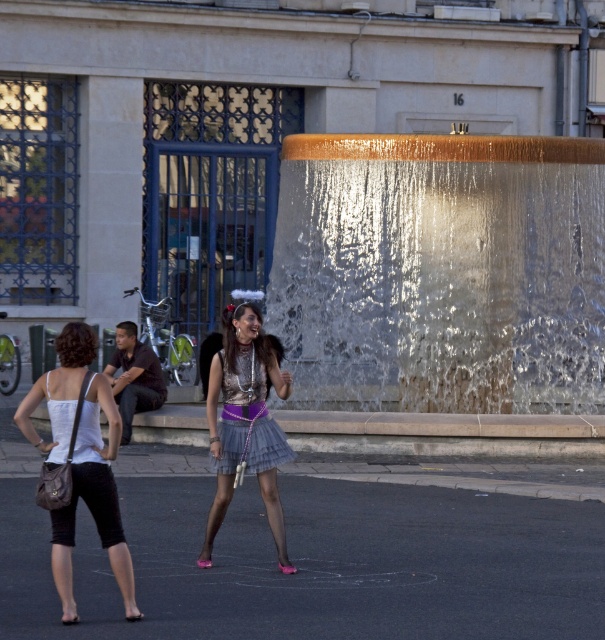
Can you confirm if white fabric tank top at lower left is positioned to the right of shiny metallic skirt at center?

No, white fabric tank top at lower left is not to the right of shiny metallic skirt at center.

Can you confirm if white fabric tank top at lower left is thinner than shiny metallic skirt at center?

Indeed, white fabric tank top at lower left has a lesser width compared to shiny metallic skirt at center.

Is point (54, 536) more distant than point (249, 310)?

No, (54, 536) is closer to viewer.

Identify the location of white fabric tank top at lower left. (93, 500).

Who is more forward, (218, 365) or (116, 410)?

Point (116, 410) is in front.

Which is behind, point (220, 384) or point (48, 378)?

The point (220, 384) is more distant.

Find the location of a particular element. shiny metallic skirt at center is located at coordinates (244, 417).

Is point (211, 445) positioned behind point (260, 420)?

No, (211, 445) is in front of (260, 420).

Where is `shiny metallic skirt at center`? shiny metallic skirt at center is located at coordinates (244, 417).